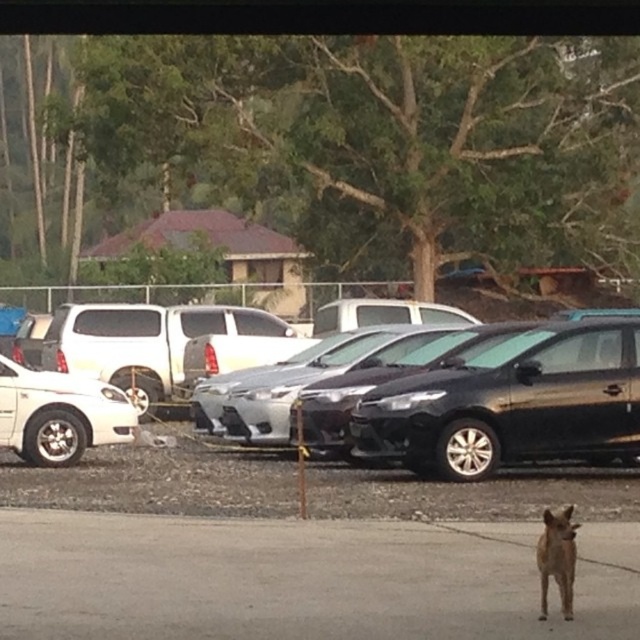
Can you confirm if glossy black car at center is positioned above brown furry dog at lower right?

Yes.

Is point (595, 436) closer to camera compared to point (541, 592)?

No, (595, 436) is further to viewer.

You are a GUI agent. You are given a task and a screenshot of the screen. Output one action in this format:
    pyautogui.click(x=<x>, y=<y>)
    Task: Click on the glossy black car at center
    This screenshot has height=640, width=640.
    Given the screenshot: What is the action you would take?
    pyautogui.click(x=513, y=403)

This screenshot has width=640, height=640. In order to click on glossy black car at center in this screenshot , I will do `click(513, 403)`.

Locate an element on the screen. The width and height of the screenshot is (640, 640). brown fur dog at lower center is located at coordinates (300, 579).

Consider the image. Can you confirm if brown fur dog at lower center is thinner than white matte sedan at left?

No.

Does point (524, 604) lie behind point (90, 432)?

No, (524, 604) is in front of (90, 432).

The image size is (640, 640). Identify the location of brown fur dog at lower center. (300, 579).

Who is positioned more to the left, satin black sedan at center or white matte sedan at left?

white matte sedan at left

Is satin black sedan at center to the right of white matte sedan at left from the viewer's perspective?

Correct, you'll find satin black sedan at center to the right of white matte sedan at left.

Between point (561, 426) and point (68, 396), which one is positioned in front?

Point (561, 426)

Where is `satin black sedan at center`? satin black sedan at center is located at coordinates (358, 396).